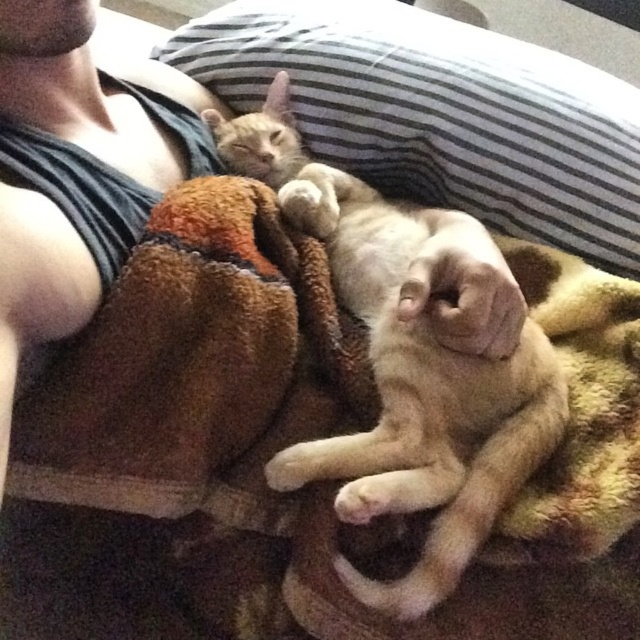
Question: Which object is farther from the camera taking this photo?

Choices:
 (A) brown fuzzy blanket at center
 (B) striped fabric pillow at upper center
 (C) orange fur cat at upper center

Answer: (B)

Question: Is striped fabric pillow at upper center to the right of orange fur cat at upper center from the viewer's perspective?

Choices:
 (A) no
 (B) yes

Answer: (B)

Question: Which of the following is the farthest from the observer?

Choices:
 (A) (371, 492)
 (B) (356, 381)

Answer: (B)

Question: Is brown fuzzy blanket at center further to the viewer compared to orange fur cat at upper center?

Choices:
 (A) yes
 (B) no

Answer: (A)

Question: Observing the image, what is the correct spatial positioning of striped fabric pillow at upper center in reference to orange fur cat at upper center?

Choices:
 (A) above
 (B) below

Answer: (A)

Question: Which object is the farthest from the orange fur cat at upper center?

Choices:
 (A) brown fuzzy blanket at center
 (B) striped fabric pillow at upper center

Answer: (B)